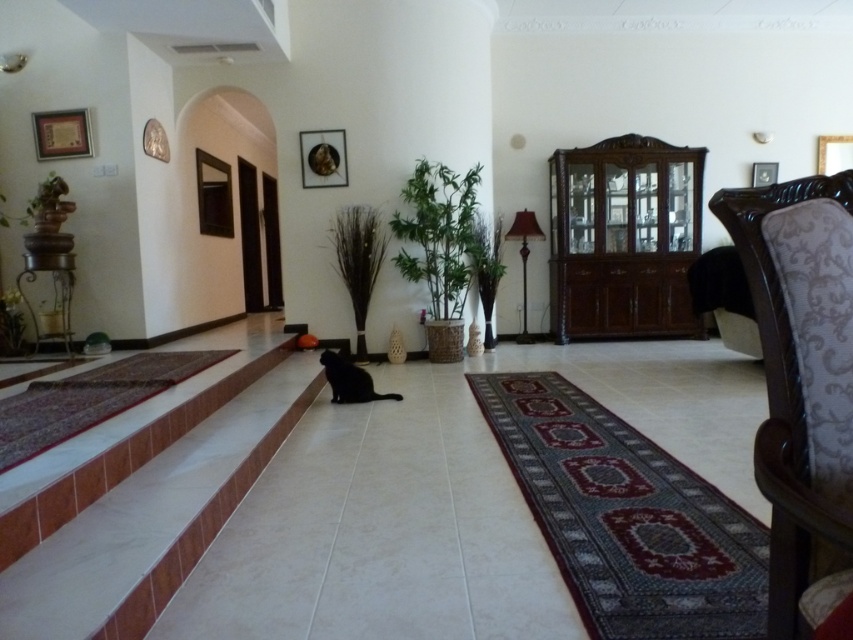
Question: Which object is positioned farthest from the black matte cat at center?

Choices:
 (A) white tile stairs at center
 (B) dark wood cabinet at center

Answer: (B)

Question: Which is farther from the white tile stairs at center?

Choices:
 (A) black matte cat at center
 (B) dark wood cabinet at center
 (C) brown textured armchair at right

Answer: (B)

Question: Is white tile stairs at center wider than brown textured armchair at right?

Choices:
 (A) yes
 (B) no

Answer: (A)

Question: Does white tile stairs at center have a greater width compared to brown textured armchair at right?

Choices:
 (A) no
 (B) yes

Answer: (B)

Question: Is dark wood cabinet at center smaller than black matte cat at center?

Choices:
 (A) yes
 (B) no

Answer: (B)

Question: Considering the real-world distances, which object is farthest from the dark wood cabinet at center?

Choices:
 (A) brown textured armchair at right
 (B) white tile stairs at center
 (C) black matte cat at center

Answer: (A)